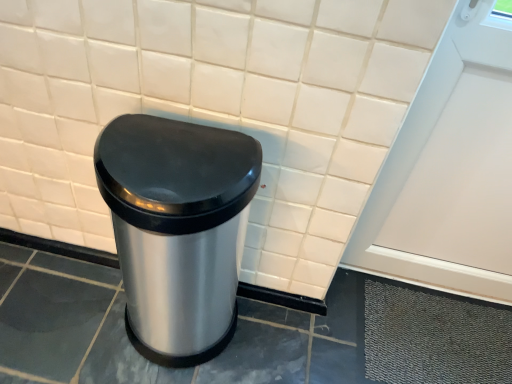
Question: Relative to white matte screen door at upper right, is satin silver trash can at center in front or behind?

Choices:
 (A) behind
 (B) front

Answer: (B)

Question: Would you say satin silver trash can at center is inside or outside white matte screen door at upper right?

Choices:
 (A) outside
 (B) inside

Answer: (A)

Question: From a real-world perspective, relative to white matte screen door at upper right, is satin silver trash can at center vertically above or below?

Choices:
 (A) below
 (B) above

Answer: (A)

Question: From the image's perspective, relative to satin silver trash can at center, is white matte screen door at upper right above or below?

Choices:
 (A) above
 (B) below

Answer: (A)

Question: Is white matte screen door at upper right spatially inside satin silver trash can at center, or outside of it?

Choices:
 (A) outside
 (B) inside

Answer: (A)

Question: Based on their positions, is white matte screen door at upper right located to the left or right of satin silver trash can at center?

Choices:
 (A) right
 (B) left

Answer: (A)

Question: From a real-world perspective, relative to satin silver trash can at center, is white matte screen door at upper right vertically above or below?

Choices:
 (A) above
 (B) below

Answer: (A)